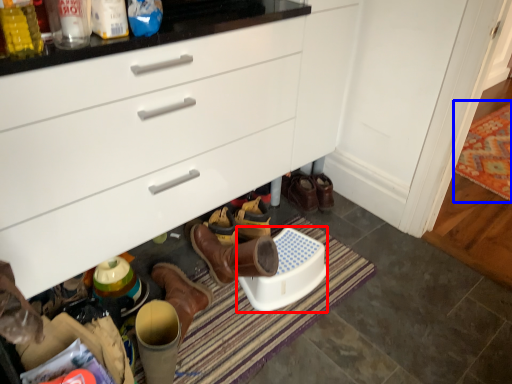
Question: Among these objects, which one is nearest to the camera, corded phone (highlighted by a red box) or mat (highlighted by a blue box)?

Choices:
 (A) corded phone
 (B) mat

Answer: (A)